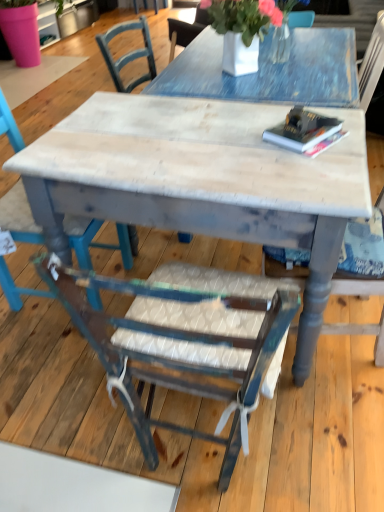
The height and width of the screenshot is (512, 384). What are the coordinates of `empty space that is ontop of distressed wood table at center (from a real-world perspective)` in the screenshot? It's located at (182, 132).